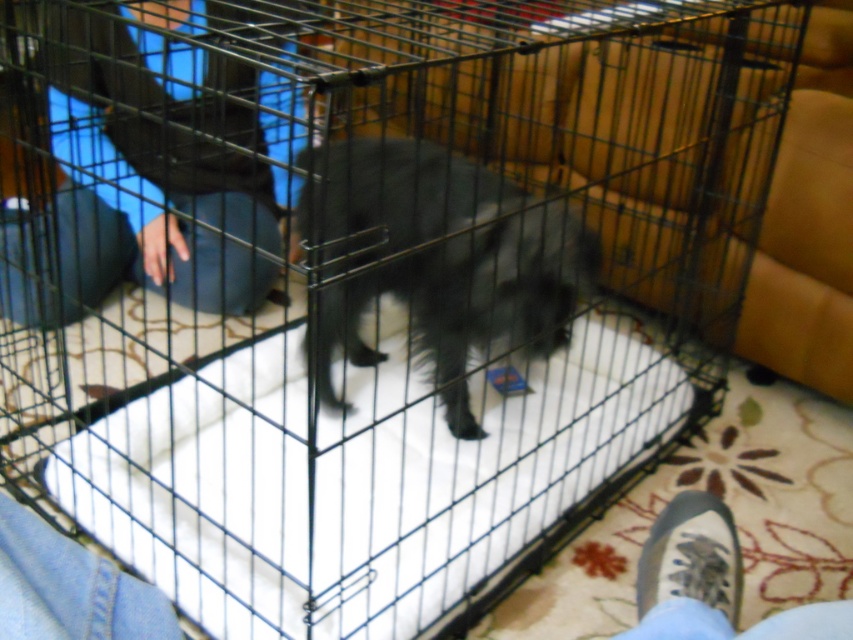
Question: Is black fuzzy dog at center wider than gray fabric shoe at lower right?

Choices:
 (A) no
 (B) yes

Answer: (B)

Question: Is blue jeans at left behind gray fabric shoe at lower right?

Choices:
 (A) no
 (B) yes

Answer: (A)

Question: Can you confirm if blue jeans at left is wider than gray fabric shoe at lower right?

Choices:
 (A) yes
 (B) no

Answer: (A)

Question: Which object is closer to the camera taking this photo?

Choices:
 (A) gray fabric shoe at lower right
 (B) blue jeans at left

Answer: (B)

Question: Which of these objects is positioned closest to the black fuzzy dog at center?

Choices:
 (A) gray fabric shoe at lower right
 (B) blue jeans at left

Answer: (B)

Question: Which point is closer to the camera taking this photo?

Choices:
 (A) (772, 634)
 (B) (198, 205)
 (C) (316, 369)

Answer: (A)